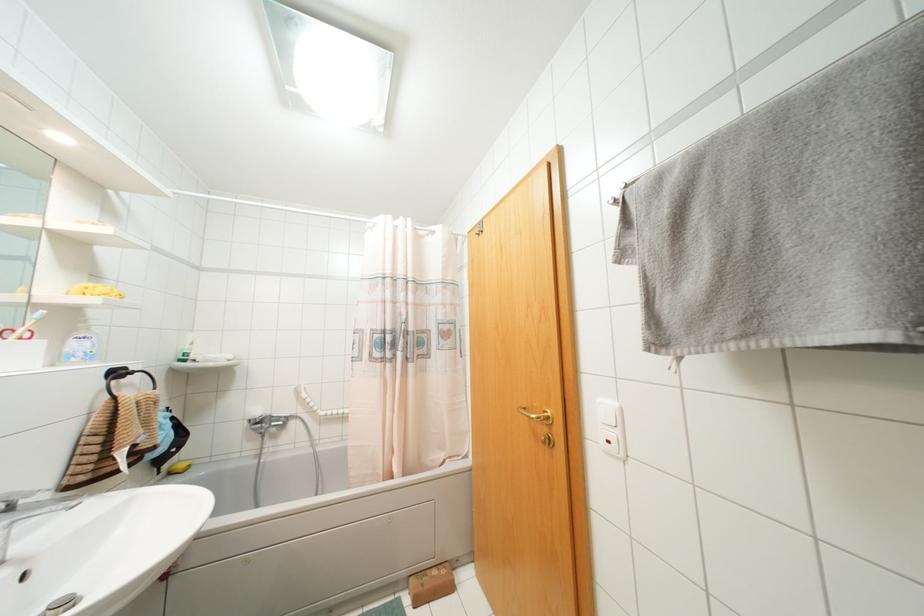
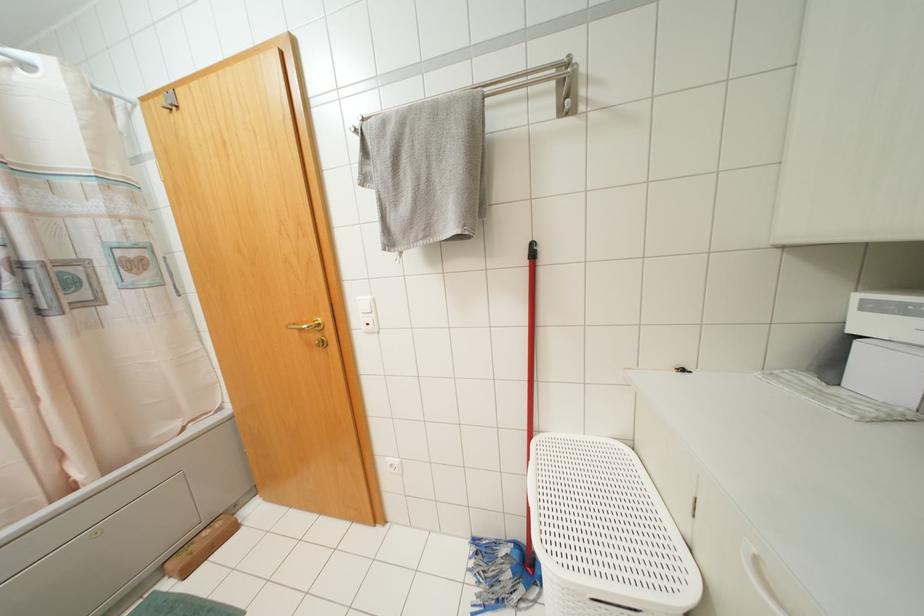
Question: The camera is either moving clockwise (left) or counter-clockwise (right) around the object. The first image is from the beginning of the video and the second image is from the end. Is the camera moving left or right when shooting the video?

Choices:
 (A) Left
 (B) Right

Answer: (A)